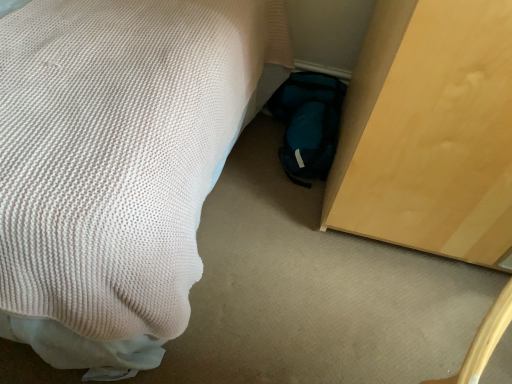
The image size is (512, 384). Identify the location of free space in front of teal fabric bag at lower center. (284, 201).